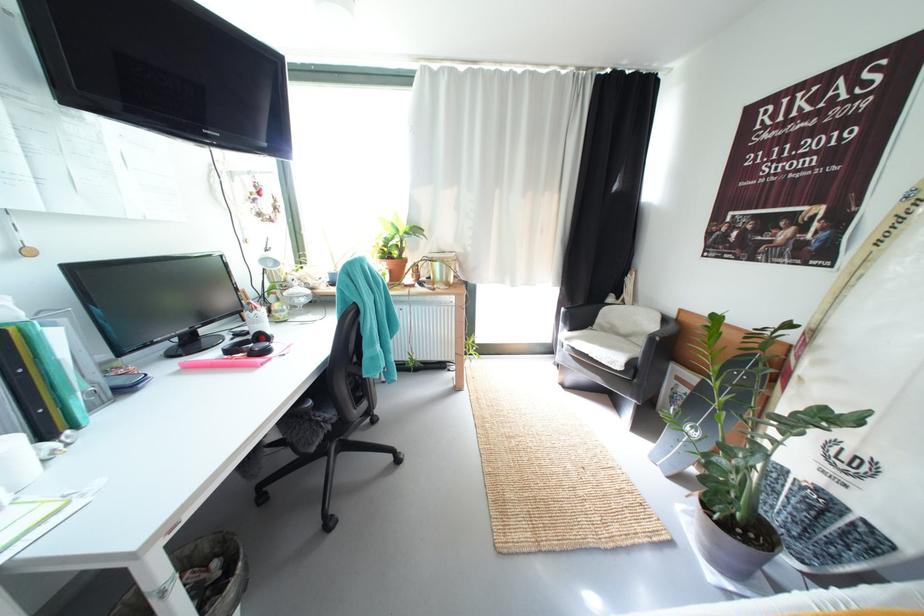
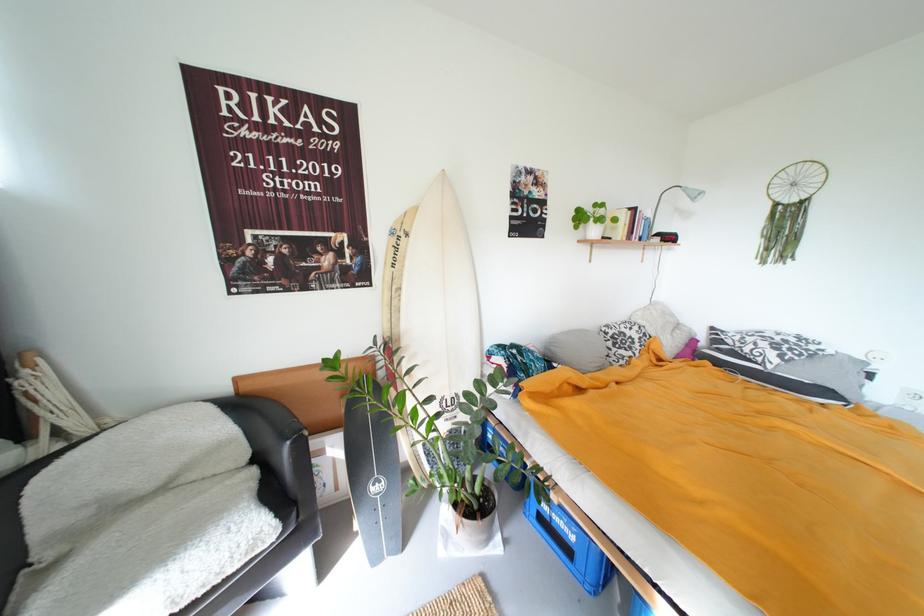
In the second image, find the point that corresponds to point 630,367 in the first image.

(284, 524)